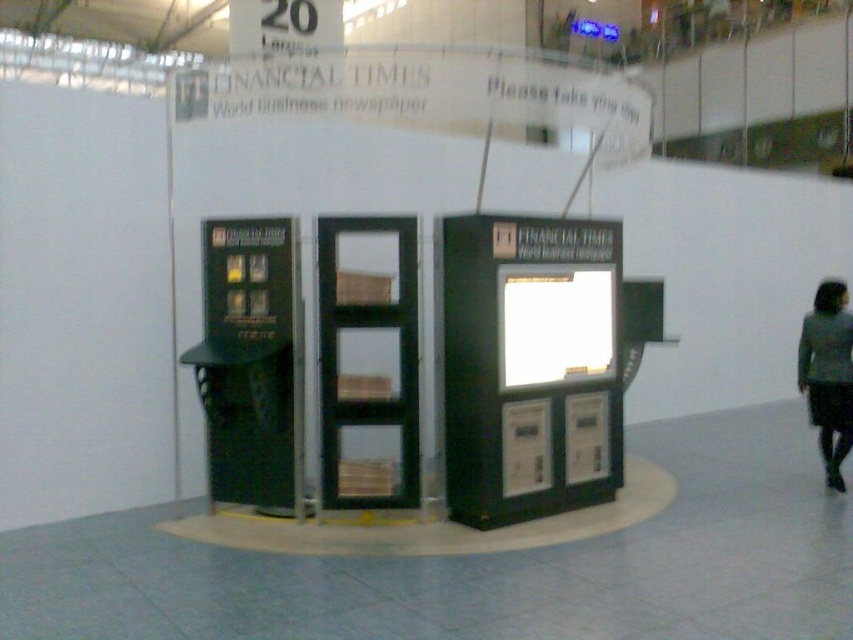
Who is lower down, matte black vending machine at center or gray fabric skirt at lower right?

Positioned lower is gray fabric skirt at lower right.

Is matte black vending machine at center above gray fabric skirt at lower right?

Yes, matte black vending machine at center is above gray fabric skirt at lower right.

Between point (450, 314) and point (814, 300), which one is positioned behind?

Point (814, 300)

The height and width of the screenshot is (640, 853). I want to click on matte black vending machine at center, so click(x=529, y=365).